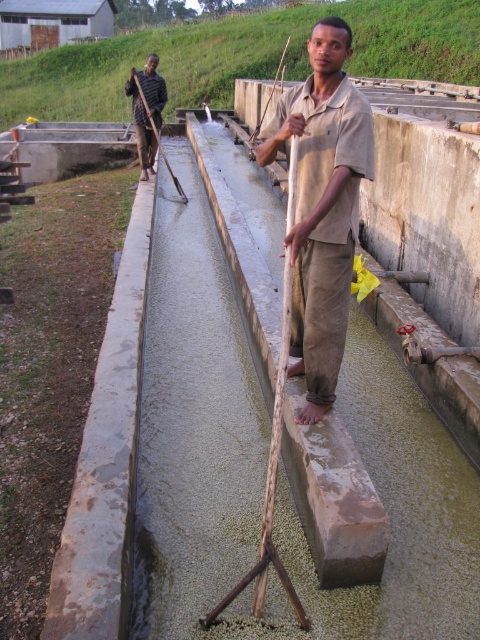
Looking at this image, you are an observer standing at the edge of the concrete channel. You see the beige cotton shirt at center and the dark brown wooden stick at upper left. Which object takes up more space in your field of view?

The dark brown wooden stick at upper left takes up more space in your field of view because it is larger than the beige cotton shirt at center.

You are a drone operator trying to locate a specific item in an image. The scene shows a fish farm with two workers. You need to find the beige cotton shirt at center. What are its coordinates?

The beige cotton shirt at center is located at coordinates point (323, 205).

You are a visitor at the fish farm and want to know which object is taller between the beige cotton shirt at center and the dark brown wooden stick at upper left. Can you tell me?

The beige cotton shirt at center is taller than the dark brown wooden stick at upper left.